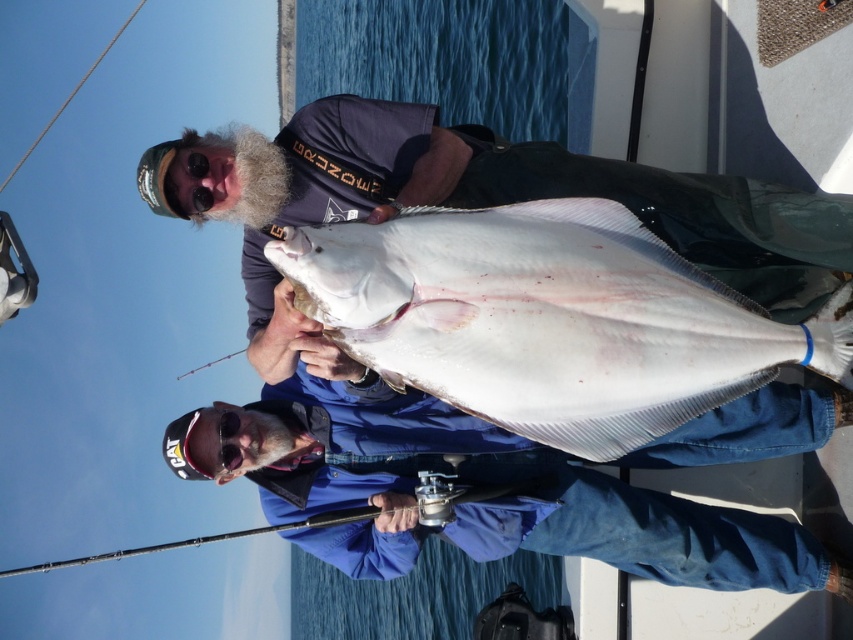
Question: Which object is positioned closest to the white smooth fish at center?

Choices:
 (A) smooth black rod at center
 (B) white matte fish at center

Answer: (B)

Question: Is white matte fish at center above smooth black rod at center?

Choices:
 (A) no
 (B) yes

Answer: (B)

Question: Which point is farther to the camera?

Choices:
 (A) white smooth fish at center
 (B) white matte fish at center

Answer: (B)

Question: Which object is positioned farthest from the white matte fish at center?

Choices:
 (A) white smooth fish at center
 (B) smooth black rod at center

Answer: (B)

Question: Does white matte fish at center have a greater width compared to smooth black rod at center?

Choices:
 (A) no
 (B) yes

Answer: (A)

Question: Is white smooth fish at center positioned in front of smooth black rod at center?

Choices:
 (A) yes
 (B) no

Answer: (A)